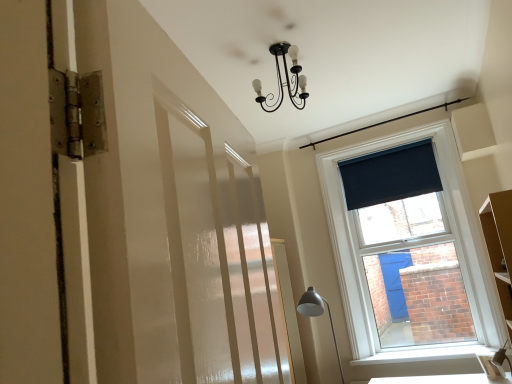
Question: From the image's perspective, is matte gray metal floor lamp at lower right beneath dark blue fabric at upper right?

Choices:
 (A) yes
 (B) no

Answer: (A)

Question: Considering the relative positions of matte gray metal floor lamp at lower right and dark blue fabric at upper right in the image provided, is matte gray metal floor lamp at lower right to the left of dark blue fabric at upper right from the viewer's perspective?

Choices:
 (A) no
 (B) yes

Answer: (B)

Question: Is the depth of matte gray metal floor lamp at lower right greater than that of dark blue fabric at upper right?

Choices:
 (A) no
 (B) yes

Answer: (A)

Question: Is matte gray metal floor lamp at lower right shorter than dark blue fabric at upper right?

Choices:
 (A) no
 (B) yes

Answer: (A)

Question: Can you confirm if matte gray metal floor lamp at lower right is positioned to the right of dark blue fabric at upper right?

Choices:
 (A) yes
 (B) no

Answer: (B)

Question: From their relative heights in the image, would you say white smooth window sill at lower right is taller or shorter than dark blue fabric at upper right?

Choices:
 (A) short
 (B) tall

Answer: (A)

Question: Would you say white smooth window sill at lower right is inside or outside dark blue fabric at upper right?

Choices:
 (A) outside
 (B) inside

Answer: (A)

Question: From a real-world perspective, is white smooth window sill at lower right physically located above or below dark blue fabric at upper right?

Choices:
 (A) below
 (B) above

Answer: (A)

Question: Considering the positions of white smooth window sill at lower right and dark blue fabric at upper right in the image, is white smooth window sill at lower right bigger or smaller than dark blue fabric at upper right?

Choices:
 (A) big
 (B) small

Answer: (B)

Question: Is matte gray metal floor lamp at lower right in front of or behind dark blue fabric at upper right in the image?

Choices:
 (A) behind
 (B) front

Answer: (B)

Question: Is matte gray metal floor lamp at lower right bigger or smaller than dark blue fabric at upper right?

Choices:
 (A) small
 (B) big

Answer: (B)

Question: Considering the positions of matte gray metal floor lamp at lower right and dark blue fabric at upper right in the image, is matte gray metal floor lamp at lower right taller or shorter than dark blue fabric at upper right?

Choices:
 (A) tall
 (B) short

Answer: (A)

Question: Considering the relative positions of matte gray metal floor lamp at lower right and dark blue fabric at upper right in the image provided, is matte gray metal floor lamp at lower right to the left or to the right of dark blue fabric at upper right?

Choices:
 (A) right
 (B) left

Answer: (B)

Question: Based on their sizes in the image, would you say white smooth window sill at lower right is bigger or smaller than matte gray metal floor lamp at lower right?

Choices:
 (A) big
 (B) small

Answer: (B)

Question: Considering their positions, is white smooth window sill at lower right located in front of or behind matte gray metal floor lamp at lower right?

Choices:
 (A) behind
 (B) front

Answer: (A)